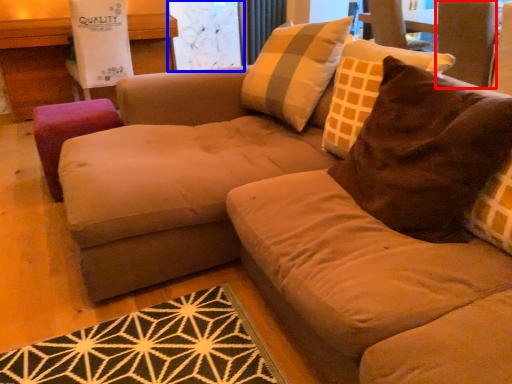
Question: Among these objects, which one is farthest to the camera, swivel chair (highlighted by a red box) or screen door (highlighted by a blue box)?

Choices:
 (A) swivel chair
 (B) screen door

Answer: (B)